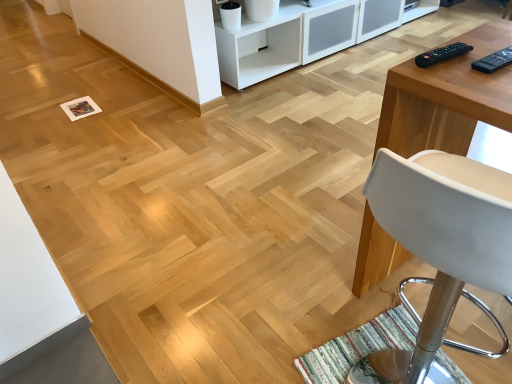
Locate an element on the screen. The image size is (512, 384). vacant space that is to the left of light wood table at right is located at coordinates (303, 285).